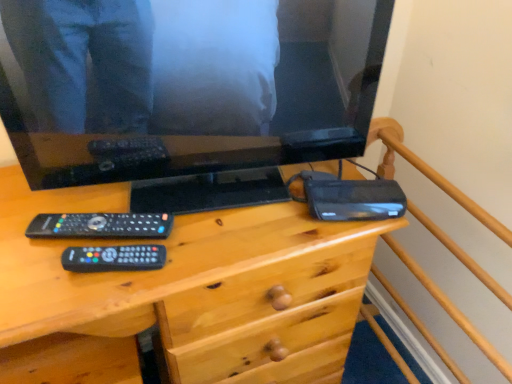
Question: From a real-world perspective, does black glossy television at upper center stand above wooden bed frame at upper right?

Choices:
 (A) yes
 (B) no

Answer: (A)

Question: Does black glossy television at upper center have a larger size compared to wooden bed frame at upper right?

Choices:
 (A) yes
 (B) no

Answer: (B)

Question: Is black glossy television at upper center directly adjacent to wooden bed frame at upper right?

Choices:
 (A) yes
 (B) no

Answer: (B)

Question: Is black glossy television at upper center at the right side of wooden bed frame at upper right?

Choices:
 (A) no
 (B) yes

Answer: (A)

Question: Does black glossy television at upper center have a greater height compared to wooden bed frame at upper right?

Choices:
 (A) yes
 (B) no

Answer: (B)

Question: Is black glossy television at upper center positioned in front of wooden bed frame at upper right?

Choices:
 (A) no
 (B) yes

Answer: (A)

Question: Is black matte router at right inside wooden desk at center?

Choices:
 (A) yes
 (B) no

Answer: (A)

Question: Is wooden desk at center not inside black matte router at right?

Choices:
 (A) yes
 (B) no

Answer: (A)

Question: From a real-world perspective, is wooden desk at center positioned over black matte router at right based on gravity?

Choices:
 (A) no
 (B) yes

Answer: (A)

Question: Is wooden desk at center wider than black matte router at right?

Choices:
 (A) yes
 (B) no

Answer: (A)

Question: From the image's perspective, is wooden desk at center located beneath black matte router at right?

Choices:
 (A) no
 (B) yes

Answer: (B)

Question: Does wooden desk at center have a lesser width compared to black matte router at right?

Choices:
 (A) no
 (B) yes

Answer: (A)

Question: Could wooden desk at center be considered to be inside black matte router at right?

Choices:
 (A) no
 (B) yes

Answer: (A)